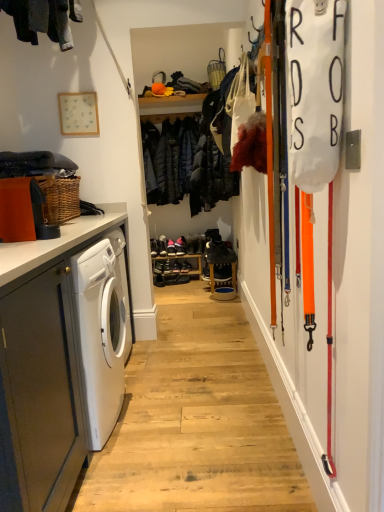
Question: Is dark blue quilted jacket at center, the first clothing positioned from the back, to the left or to the right of dark gray fabric at left, acting as the second clothing starting from the right, in the image?

Choices:
 (A) left
 (B) right

Answer: (B)

Question: Does point (185, 146) appear closer or farther from the camera than point (21, 159)?

Choices:
 (A) farther
 (B) closer

Answer: (A)

Question: Considering the real-world distances, which object is farthest from the dark blue quilted jacket at center, the first clothing positioned from the back?

Choices:
 (A) matte gray cabinet at left
 (B) dark gray fabric at left, which is the 2th clothing in back-to-front order
 (C) matte black basket at upper center

Answer: (A)

Question: Which object is positioned farthest from the matte gray cabinet at left?

Choices:
 (A) matte black basket at upper center
 (B) dark gray fabric at left, acting as the second clothing starting from the right
 (C) dark blue quilted jacket at center, positioned as the second clothing in front-to-back order

Answer: (A)